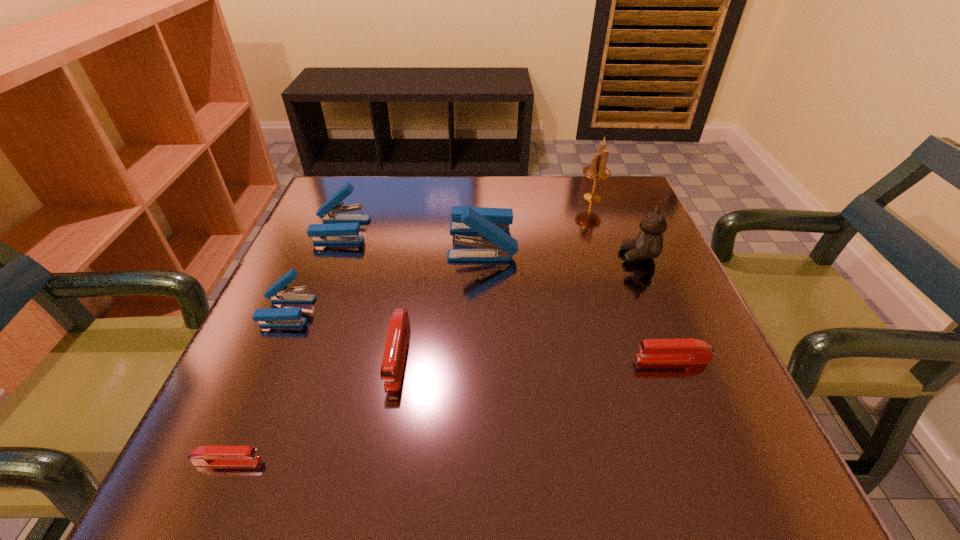
Where is `the second red stapler from left to right`? the second red stapler from left to right is located at coordinates (392, 364).

You are a GUI agent. You are given a task and a screenshot of the screen. Output one action in this format:
    pyautogui.click(x=<x>, y=<y>)
    Task: Click on the second shortest stapler
    
    Given the screenshot: What is the action you would take?
    pyautogui.click(x=689, y=350)

You are a GUI agent. You are given a task and a screenshot of the screen. Output one action in this format:
    pyautogui.click(x=<x>, y=<y>)
    Task: Click on the second smallest red stapler
    This screenshot has width=960, height=540.
    Given the screenshot: What is the action you would take?
    689,350

Locate an element on the screen. This screenshot has width=960, height=540. the nearest stapler is located at coordinates (212, 456).

Locate an element on the screen. The width and height of the screenshot is (960, 540). the leftmost red stapler is located at coordinates point(212,456).

In order to click on vacant space located 0.070m on the back of the farthest object in this screenshot , I will do `click(585, 177)`.

The width and height of the screenshot is (960, 540). What are the coordinates of `vacant region located on the left of the fifth object from left to right` in the screenshot? It's located at (297, 242).

What are the coordinates of `free space located on the face of the brown teddy bear` in the screenshot? It's located at (538, 255).

I want to click on vacant space located 0.270m on the face of the brown teddy bear, so click(x=495, y=255).

The height and width of the screenshot is (540, 960). Find the location of `free point located on the face of the brown teddy bear`. free point located on the face of the brown teddy bear is located at coordinates tap(523, 255).